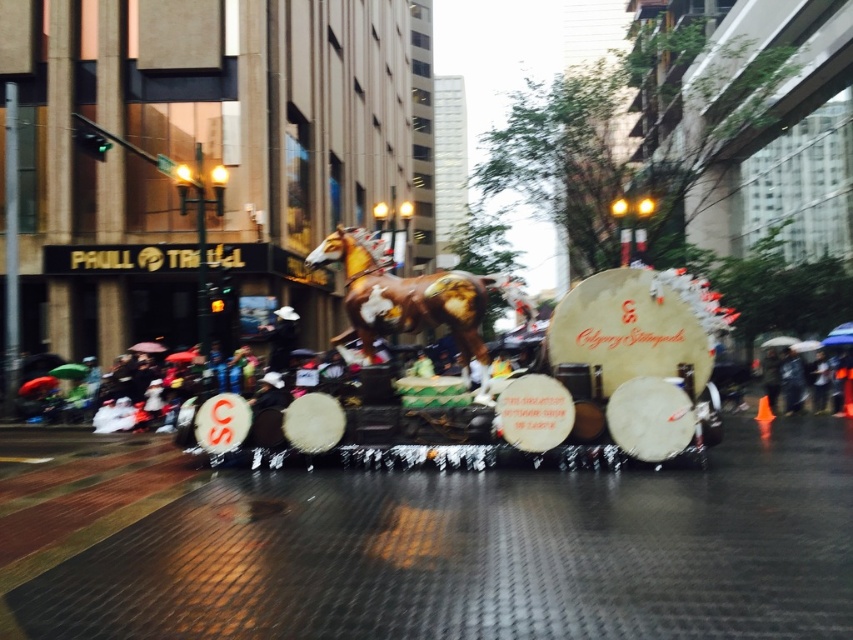
Can you confirm if shiny gold horse at center is positioned below green fabric umbrella at center?

Incorrect, shiny gold horse at center is not positioned below green fabric umbrella at center.

Which is behind, point (573, 301) or point (426, 358)?

Point (426, 358)

You are a GUI agent. You are given a task and a screenshot of the screen. Output one action in this format:
    pyautogui.click(x=<x>, y=<y>)
    Task: Click on the shiny gold horse at center
    
    Given the screenshot: What is the action you would take?
    pyautogui.click(x=566, y=387)

Between point (364, 305) and point (776, 353), which one is positioned behind?

Point (776, 353)

Where is `shiny brown horse at center`? Image resolution: width=853 pixels, height=640 pixels. shiny brown horse at center is located at coordinates (409, 296).

In the scene shown: Does shiny gold horse at center appear under raincoat fabric umbrella at lower right?

Actually, shiny gold horse at center is above raincoat fabric umbrella at lower right.

Which is above, shiny gold horse at center or raincoat fabric umbrella at lower right?

shiny gold horse at center is above.

Where is `shiny gold horse at center`? shiny gold horse at center is located at coordinates (566, 387).